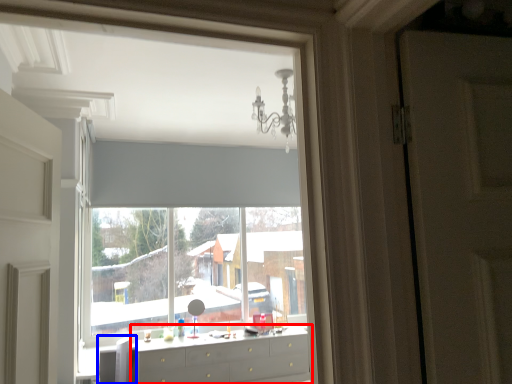
Question: Which of the following is the closest to the observer, chest of drawers (highlighted by a red box) or swivel chair (highlighted by a blue box)?

Choices:
 (A) chest of drawers
 (B) swivel chair

Answer: (A)